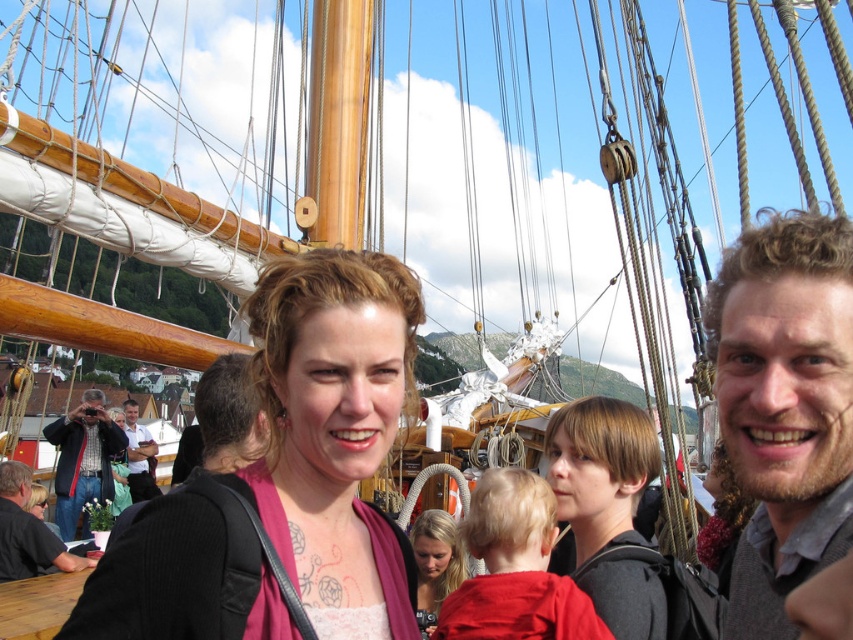
Question: Does brown hair at center appear on the right side of dark gray shirt at lower left?

Choices:
 (A) no
 (B) yes

Answer: (B)

Question: Among these objects, which one is farthest from the camera?

Choices:
 (A) brushed metal camera at lower left
 (B) curly hair man at right
 (C) brown hair at center
 (D) smooth blonde hair at center

Answer: (A)

Question: Which object appears closest to the camera in this image?

Choices:
 (A) curly hair man at right
 (B) brown hair at center
 (C) brushed metal camera at lower left

Answer: (A)

Question: Can you confirm if smooth brown hair at center is bigger than smooth blonde hair at center?

Choices:
 (A) yes
 (B) no

Answer: (A)

Question: Is brown hair at center positioned at the back of white shirt at center?

Choices:
 (A) yes
 (B) no

Answer: (B)

Question: Estimate the real-world distances between objects in this image. Which object is closer to the brushed metal camera at lower left?

Choices:
 (A) dark gray shirt at lower left
 (B) curly hair man at right

Answer: (A)